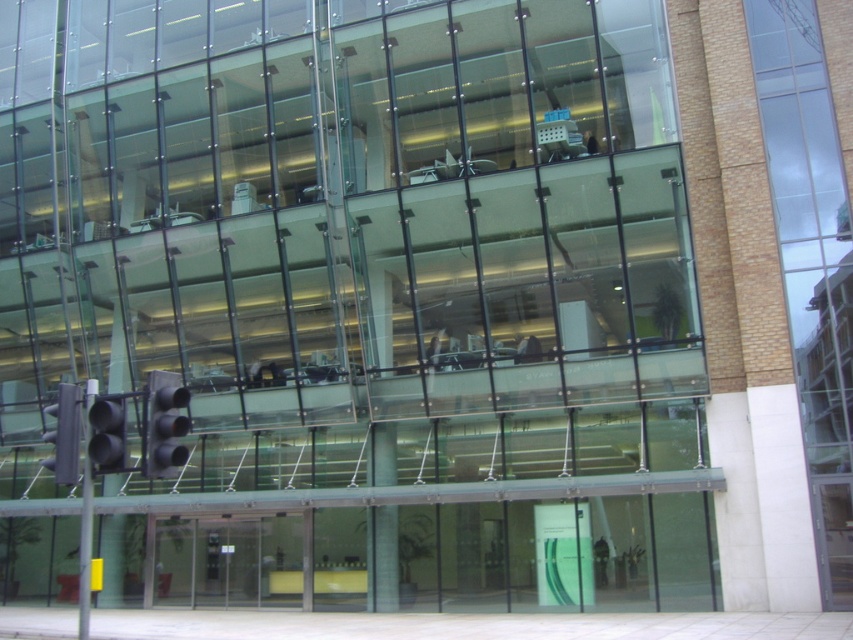
You are standing in front of the modern glass building and see the gray metallic traffic light at lower left and the metallic silver car at center. Which object is nearer to you?

The gray metallic traffic light at lower left is closer to the viewer than the metallic silver car at center.

You are a driver approaching the intersection near the modern glass building. You see the black matte traffic light at lower left and the metallic silver car at center. Which object is narrower?

The black matte traffic light at lower left is narrower than the metallic silver car at center.